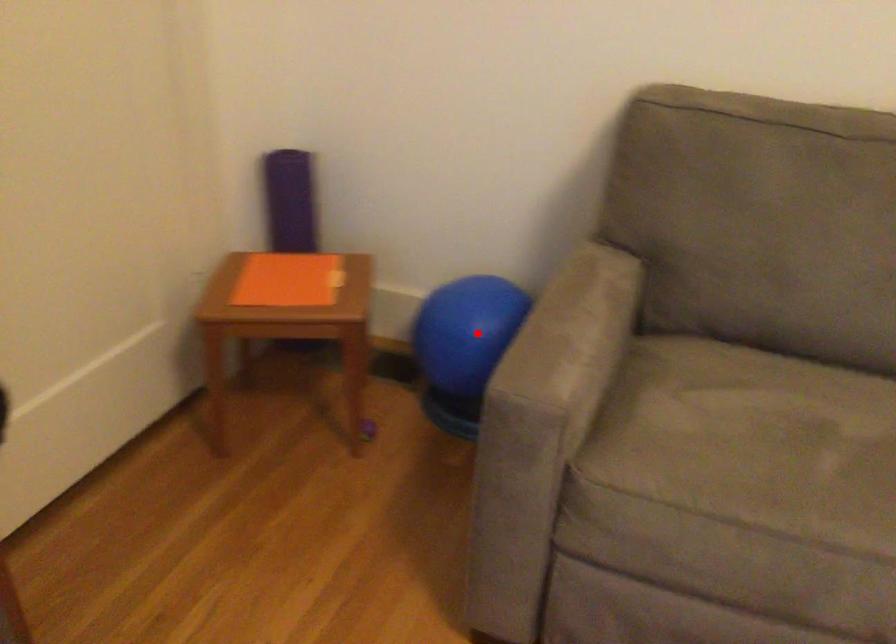
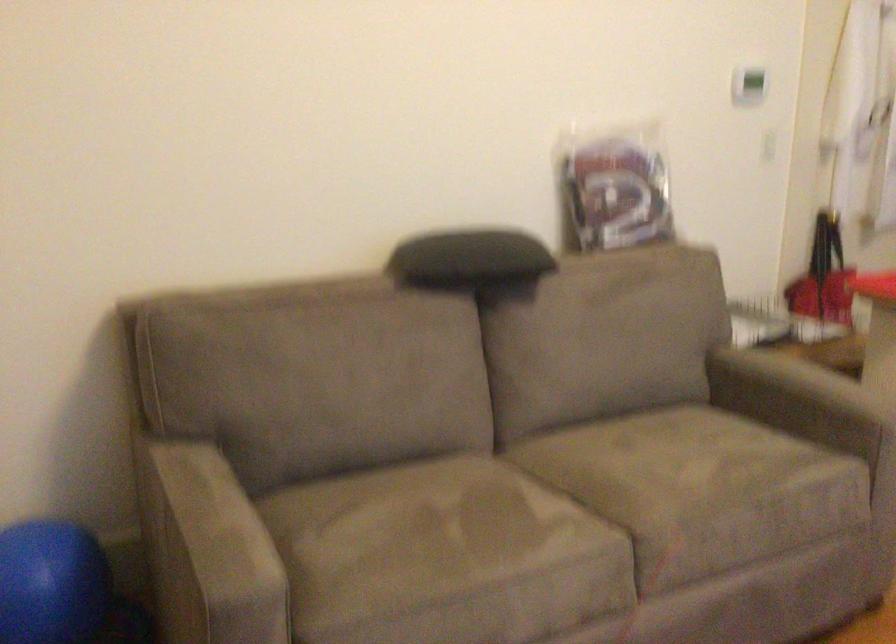
Question: I am providing you with two images of the same scene from different viewpoints. In image1, a red point is highlighted. Considering the same 3D point in image2, which of the following is correct?

Choices:
 (A) It is closer
 (B) It is farther

Answer: (A)